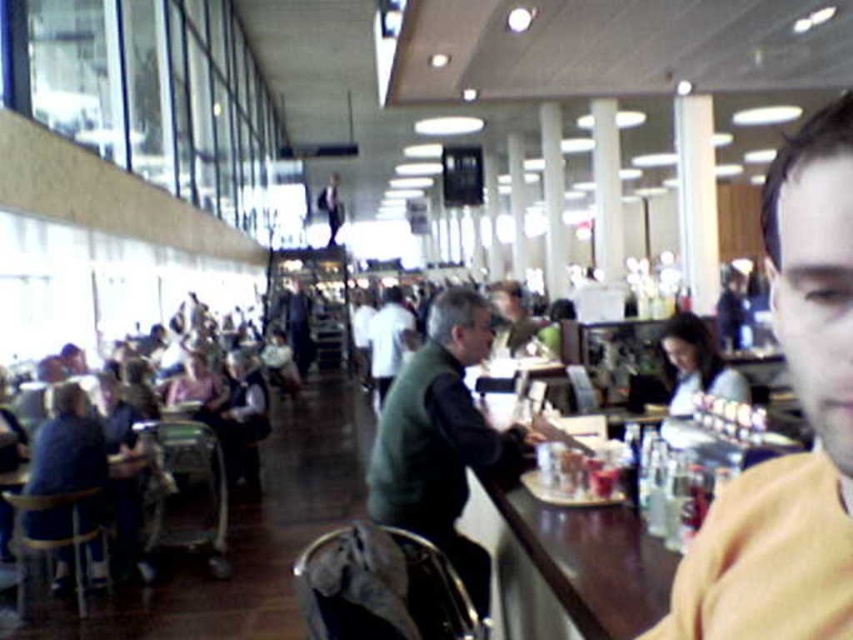
Question: Can you confirm if yellow fabric shirt at right is positioned to the left of white shirt at center?

Choices:
 (A) yes
 (B) no

Answer: (B)

Question: Can you confirm if yellow fabric shirt at right is wider than wooden table at center?

Choices:
 (A) yes
 (B) no

Answer: (A)

Question: Which object appears closest to the camera in this image?

Choices:
 (A) yellow fabric shirt at right
 (B) white shirt at center

Answer: (A)

Question: Which is nearer to the white shirt at center?

Choices:
 (A) green fuzzy vest at center
 (B) wooden table at center
 (C) yellow fabric shirt at right

Answer: (A)

Question: Which of the following is the closest to the observer?

Choices:
 (A) green fuzzy vest at center
 (B) yellow fabric shirt at right

Answer: (B)

Question: Is green fuzzy vest at center closer to camera compared to white shirt at center?

Choices:
 (A) no
 (B) yes

Answer: (B)